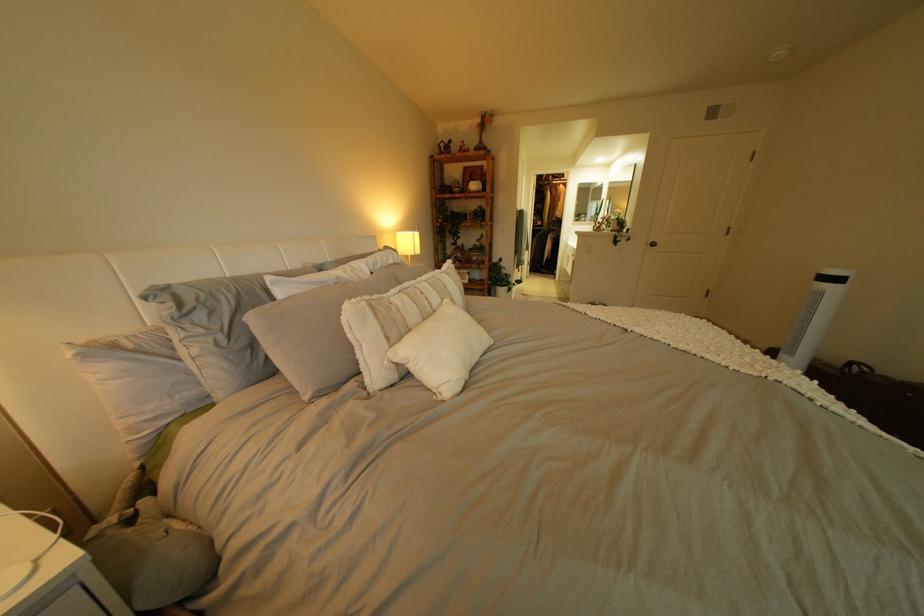
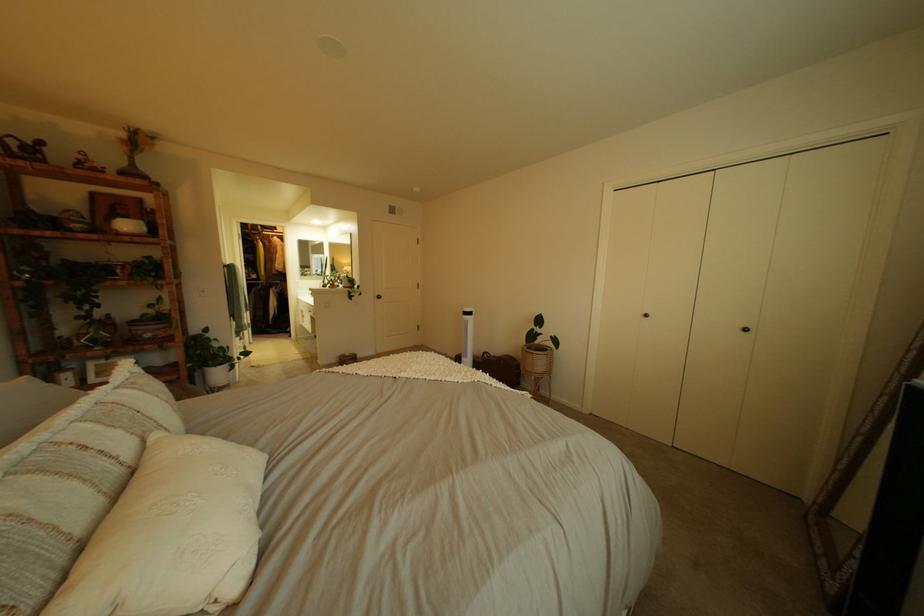
The point at (491, 246) is marked in the first image. Where is the corresponding point in the second image?

(161, 315)